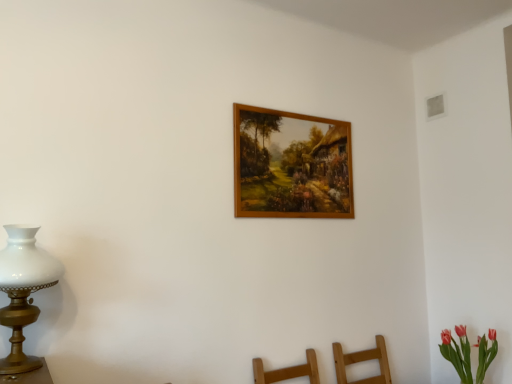
Question: Is vivid pink petals at lower right next to white glass lamp at left?

Choices:
 (A) yes
 (B) no

Answer: (B)

Question: Is vivid pink petals at lower right further to the viewer compared to white glass lamp at left?

Choices:
 (A) yes
 (B) no

Answer: (A)

Question: Is vivid pink petals at lower right to the right of white glass lamp at left from the viewer's perspective?

Choices:
 (A) yes
 (B) no

Answer: (A)

Question: From the image's perspective, is vivid pink petals at lower right on top of white glass lamp at left?

Choices:
 (A) no
 (B) yes

Answer: (A)

Question: Can you confirm if vivid pink petals at lower right is positioned to the left of white glass lamp at left?

Choices:
 (A) no
 (B) yes

Answer: (A)

Question: Could you tell me if vivid pink petals at lower right is turned towards white glass lamp at left?

Choices:
 (A) yes
 (B) no

Answer: (A)

Question: Does vivid pink petals at lower right have a smaller size compared to wooden picture frame at upper center?

Choices:
 (A) no
 (B) yes

Answer: (A)

Question: Can we say vivid pink petals at lower right lies outside wooden picture frame at upper center?

Choices:
 (A) no
 (B) yes

Answer: (B)

Question: From the image's perspective, is vivid pink petals at lower right over wooden picture frame at upper center?

Choices:
 (A) yes
 (B) no

Answer: (B)

Question: Are vivid pink petals at lower right and wooden picture frame at upper center beside each other?

Choices:
 (A) yes
 (B) no

Answer: (B)

Question: Is the position of vivid pink petals at lower right less distant than that of wooden picture frame at upper center?

Choices:
 (A) no
 (B) yes

Answer: (B)

Question: Can you confirm if vivid pink petals at lower right is thinner than wooden picture frame at upper center?

Choices:
 (A) no
 (B) yes

Answer: (A)

Question: Can you confirm if white glass lamp at left is smaller than wooden picture frame at upper center?

Choices:
 (A) yes
 (B) no

Answer: (B)